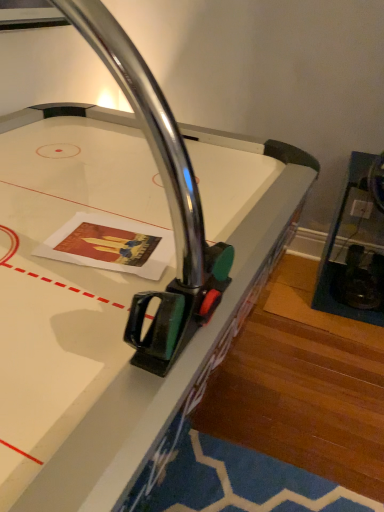
Identify the location of free space that is to the left of metallic glass shelf at right. (288, 302).